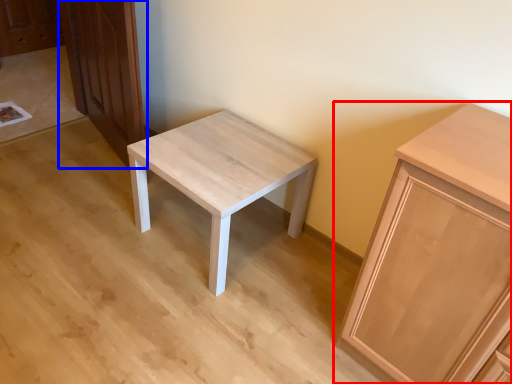
Question: Which object appears farthest to the camera in this image, cabinetry (highlighted by a red box) or dresser (highlighted by a blue box)?

Choices:
 (A) cabinetry
 (B) dresser

Answer: (B)